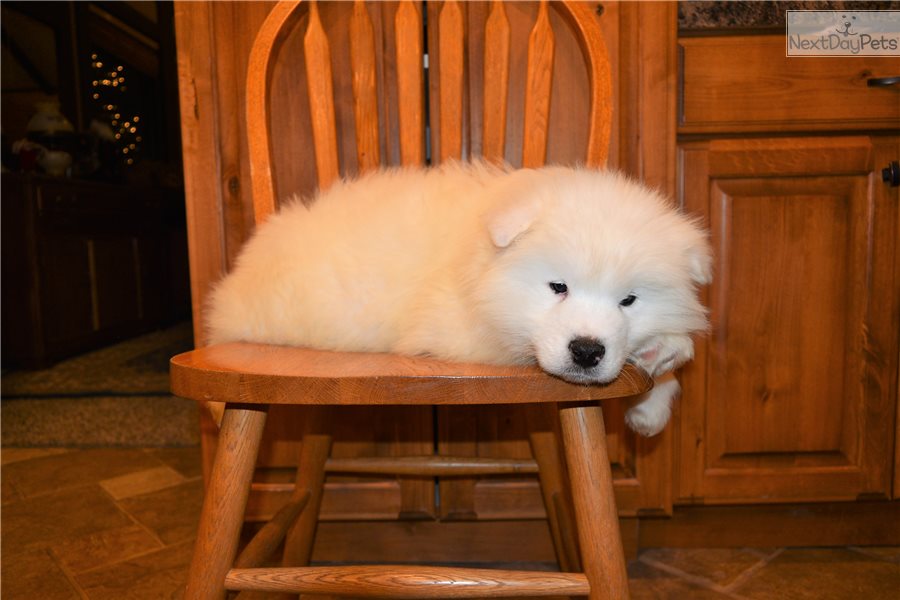
Where is `chair`? chair is located at coordinates (317, 383).